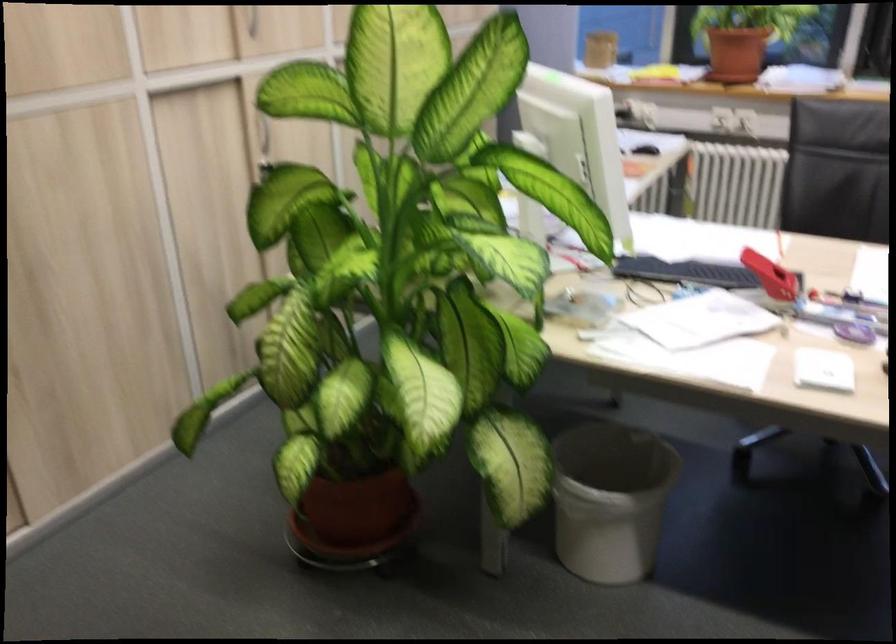
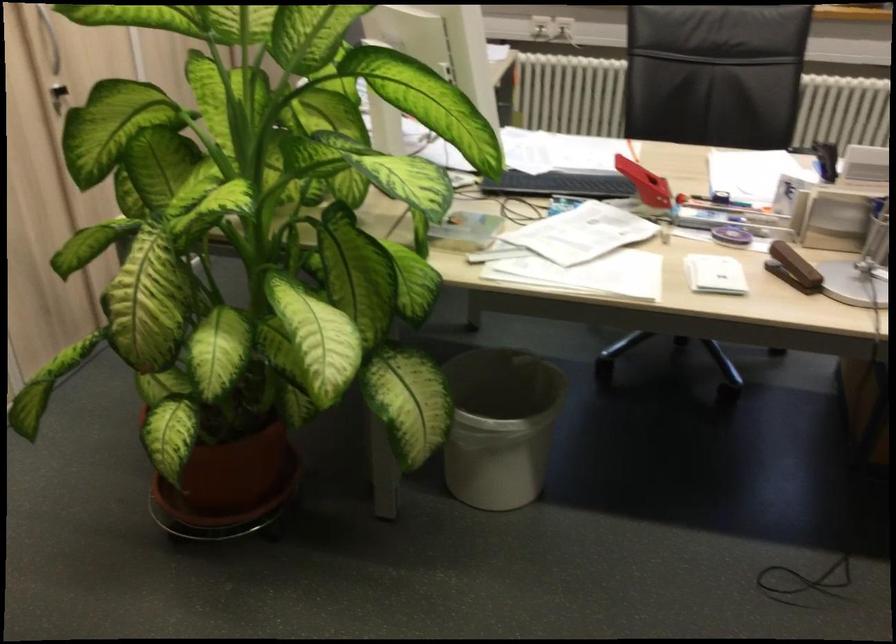
Where in the second image is the point corresponding to point 770,275 from the first image?

(644, 183)